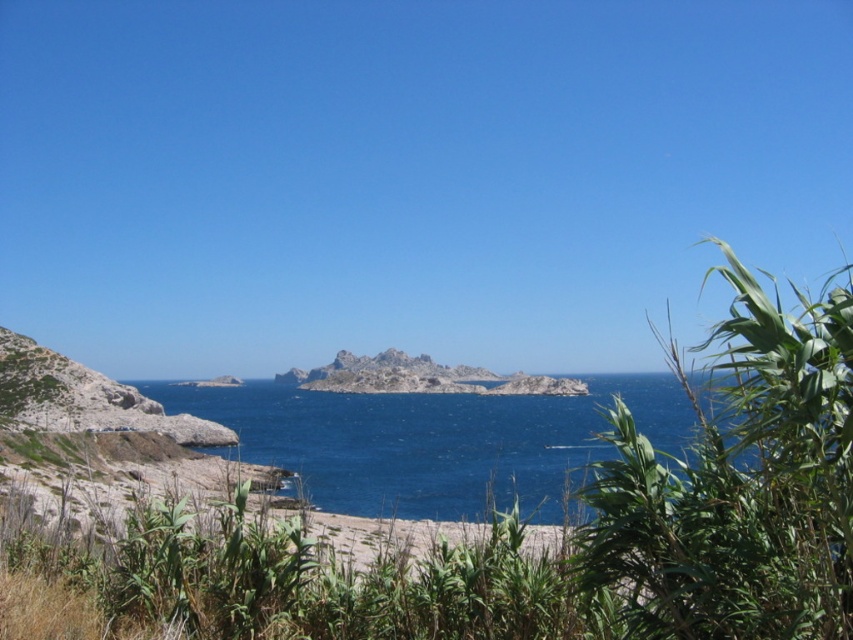
Between point (683, 563) and point (537, 380), which one is positioned in front?

Point (683, 563)

Who is taller, green leafy plant at right or rocky island at center?

rocky island at center is taller.

Who is more distant from viewer, (839, 461) or (425, 368)?

The point (425, 368) is behind.

I want to click on green leafy plant at right, so click(740, 486).

Does blue water at center have a lesser height compared to rocky island at center?

In fact, blue water at center may be taller than rocky island at center.

Measure the distance from blue water at center to rocky island at center.

They are 74.10 meters apart.

Where is `blue water at center`? Image resolution: width=853 pixels, height=640 pixels. blue water at center is located at coordinates (x=436, y=442).

Between green leafy plant at right and blue water at center, which one is positioned higher?

Positioned higher is green leafy plant at right.

Does green leafy plant at right come behind blue water at center?

No, green leafy plant at right is closer to the viewer.

Is point (705, 556) less distant than point (380, 468)?

Yes.

Identify the location of green leafy plant at right. The image size is (853, 640). (740, 486).